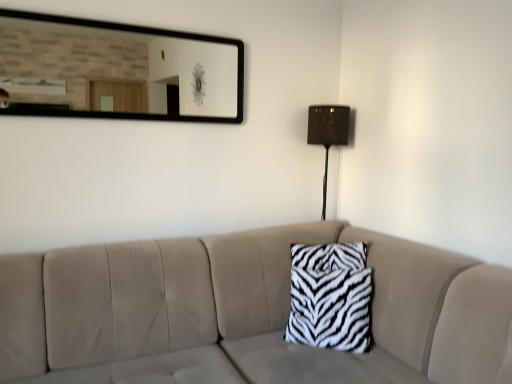
Question: Is zebra-patterned fabric pillow at center touching white zebra-patterned pillow at center?

Choices:
 (A) yes
 (B) no

Answer: (B)

Question: Could you tell me if zebra-patterned fabric pillow at center is facing white zebra-patterned pillow at center?

Choices:
 (A) no
 (B) yes

Answer: (B)

Question: From a real-world perspective, is zebra-patterned fabric pillow at center positioned under white zebra-patterned pillow at center based on gravity?

Choices:
 (A) no
 (B) yes

Answer: (A)

Question: Is zebra-patterned fabric pillow at center not inside white zebra-patterned pillow at center?

Choices:
 (A) no
 (B) yes

Answer: (A)

Question: Can you confirm if zebra-patterned fabric pillow at center is wider than white zebra-patterned pillow at center?

Choices:
 (A) yes
 (B) no

Answer: (B)

Question: Is zebra-patterned fabric pillow at center shorter than white zebra-patterned pillow at center?

Choices:
 (A) no
 (B) yes

Answer: (B)

Question: Considering the relative positions of zebra-patterned fabric pillow at center and matte brown table lamp at right in the image provided, is zebra-patterned fabric pillow at center in front of matte brown table lamp at right?

Choices:
 (A) yes
 (B) no

Answer: (A)

Question: Does zebra-patterned fabric pillow at center have a greater height compared to matte brown table lamp at right?

Choices:
 (A) no
 (B) yes

Answer: (A)

Question: Is zebra-patterned fabric pillow at center thinner than matte brown table lamp at right?

Choices:
 (A) yes
 (B) no

Answer: (B)

Question: Is zebra-patterned fabric pillow at center at the left side of matte brown table lamp at right?

Choices:
 (A) yes
 (B) no

Answer: (A)

Question: Does zebra-patterned fabric pillow at center appear on the right side of matte brown table lamp at right?

Choices:
 (A) no
 (B) yes

Answer: (A)

Question: Is zebra-patterned fabric pillow at center placed right next to matte brown table lamp at right?

Choices:
 (A) no
 (B) yes

Answer: (A)

Question: Can zebra-patterned fabric pillow at center be found inside white zebra-patterned pillow at center?

Choices:
 (A) yes
 (B) no

Answer: (A)